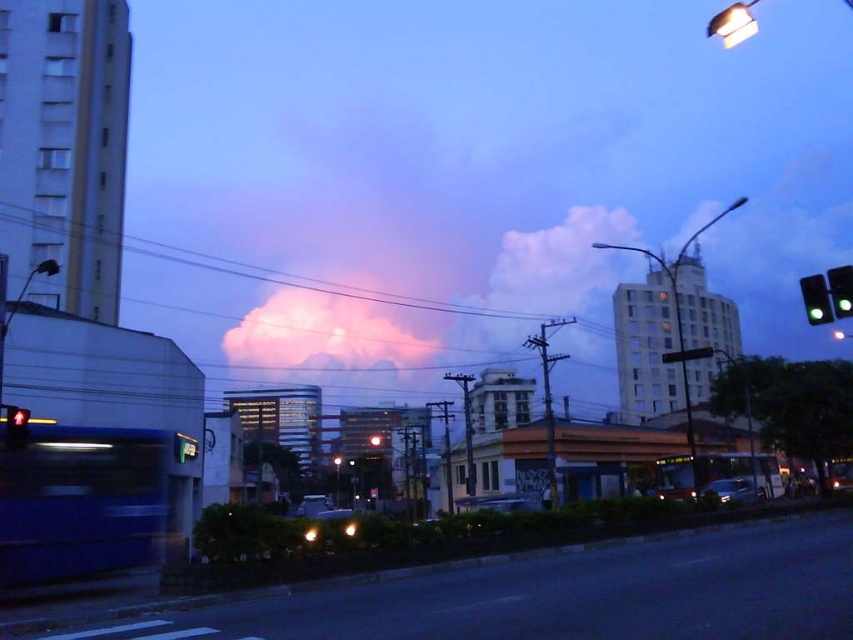
From the picture: You are a delivery person trying to navigate the street. You see the green glass traffic light at upper right and the red glass pedestrian signal at left. Which one is taller?

The green glass traffic light at upper right is taller than the red glass pedestrian signal at left.

You are standing on the street in the image and looking up at the sky. There is a point at coordinates point (323, 330). What is located at that point?

The point (323, 330) is on a pink fluffy cloud at upper center.